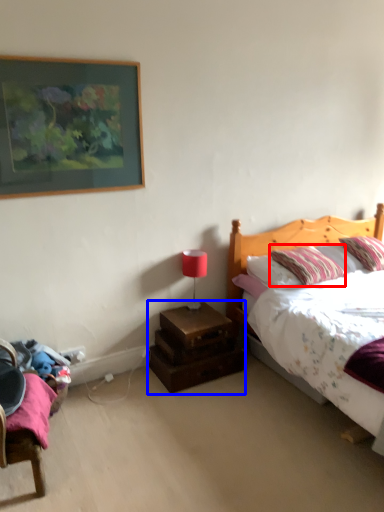
Question: Which of the following is the farthest to the observer, pillow (highlighted by a red box) or nightstand (highlighted by a blue box)?

Choices:
 (A) pillow
 (B) nightstand

Answer: (B)